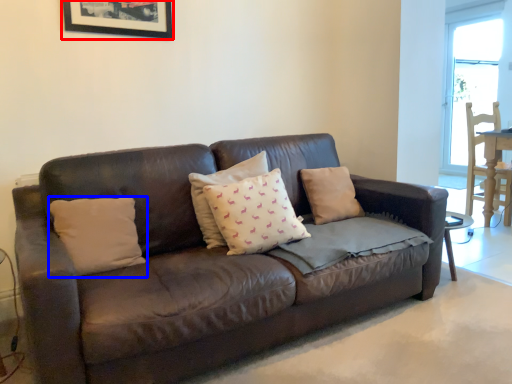
Question: Which of the following is the farthest to the observer, picture frame (highlighted by a red box) or pillow (highlighted by a blue box)?

Choices:
 (A) picture frame
 (B) pillow

Answer: (A)